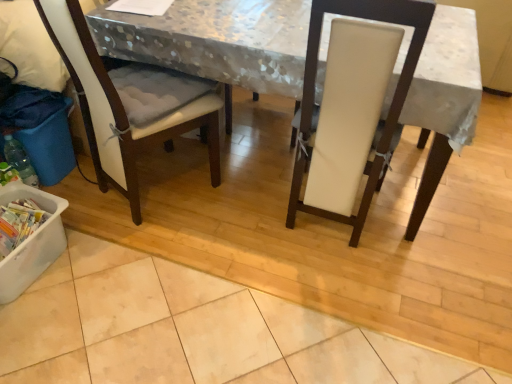
Image resolution: width=512 pixels, height=384 pixels. In order to click on free spot to the right of white plastic container at lower left, placed as the 2th recycling bin when sorted from top to bottom in this screenshot , I will do `click(102, 272)`.